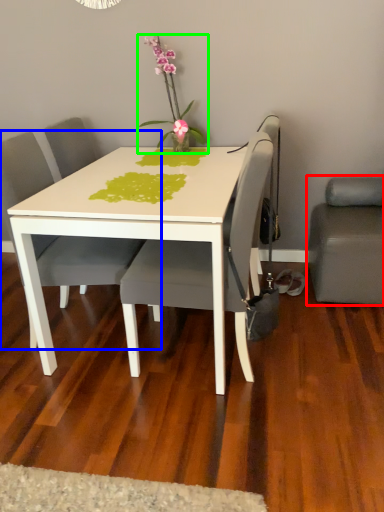
Question: Considering the real-world distances, which object is farthest from studio couch (highlighted by a red box)? chair (highlighted by a blue box) or houseplant (highlighted by a green box)?

Choices:
 (A) chair
 (B) houseplant

Answer: (A)